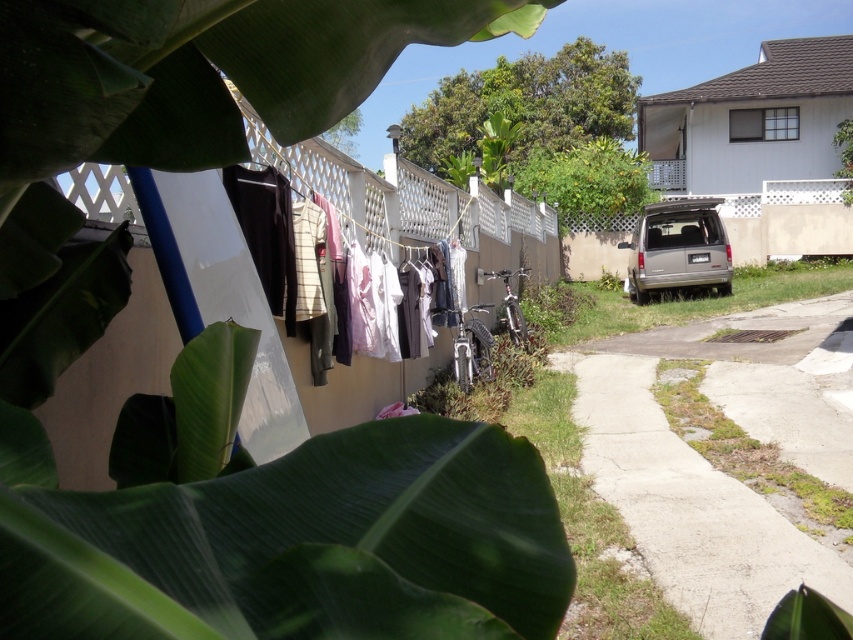
Can you confirm if white cotton shirts at center is bigger than silver metallic van at right?

Incorrect, white cotton shirts at center is not larger than silver metallic van at right.

Does white cotton shirts at center have a lesser width compared to silver metallic van at right?

Yes, white cotton shirts at center is thinner than silver metallic van at right.

This screenshot has width=853, height=640. Describe the element at coordinates (268, 236) in the screenshot. I see `white cotton shirts at center` at that location.

Where is `white cotton shirts at center`? The width and height of the screenshot is (853, 640). white cotton shirts at center is located at coordinates (268, 236).

Who is more forward, (636, 321) or (722, 198)?

Point (636, 321) is more forward.

Which is below, green leafy plant at right or silver metallic van at right?

green leafy plant at right is lower down.

Does point (621, 323) lie in front of point (722, 234)?

Yes, it is in front of point (722, 234).

The image size is (853, 640). Find the location of `green leafy plant at right`. green leafy plant at right is located at coordinates (674, 300).

Based on the photo, who is taller, green grass at lower right or silver metallic van at right?

silver metallic van at right

Between point (694, 392) and point (706, 272), which one is positioned in front?

Point (694, 392) is more forward.

Which is behind, point (717, 460) or point (708, 241)?

The point (708, 241) is behind.

Locate an element on the screen. Image resolution: width=853 pixels, height=640 pixels. green grass at lower right is located at coordinates (749, 454).